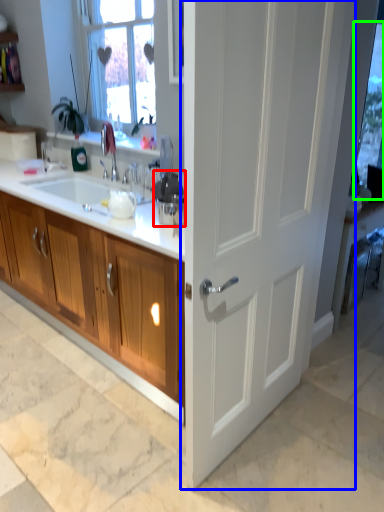
Question: Considering the real-world distances, which object is farthest from appliance (highlighted by a red box)? door (highlighted by a blue box) or window screen (highlighted by a green box)?

Choices:
 (A) door
 (B) window screen

Answer: (B)